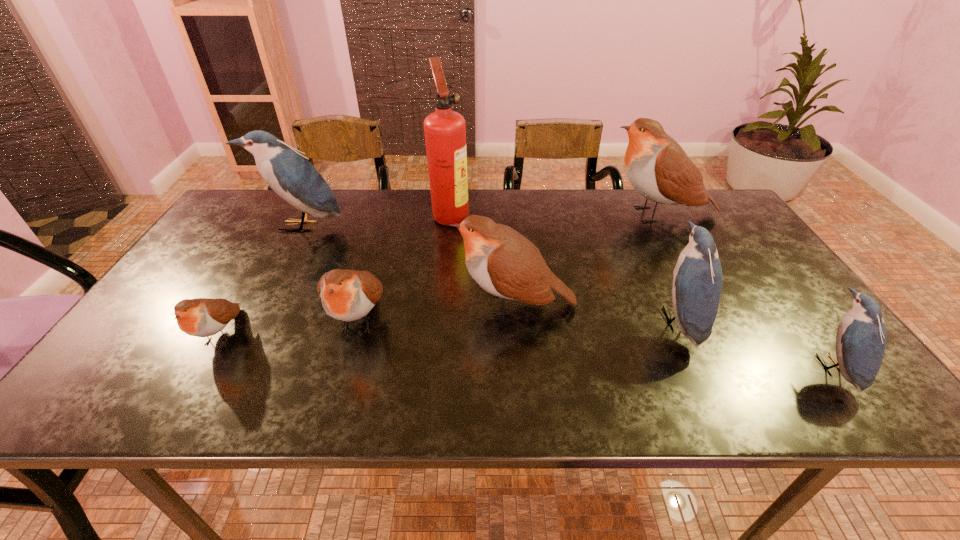
Find the location of a particular element. The width and height of the screenshot is (960, 540). free spot located at the face of the fourth bird from right to left is located at coordinates (397, 305).

Locate an element on the screen. Image resolution: width=960 pixels, height=540 pixels. free space located 0.160m at the face of the fourth bird from right to left is located at coordinates (389, 305).

The width and height of the screenshot is (960, 540). I want to click on blank space located at the tip of the second smallest blue bird's beak, so click(x=558, y=320).

The height and width of the screenshot is (540, 960). I want to click on vacant space situated 0.320m at the tip of the second smallest blue bird's beak, so click(524, 320).

Image resolution: width=960 pixels, height=540 pixels. In order to click on vacant point located 0.060m at the tip of the second smallest blue bird's beak in this screenshot , I will do `click(634, 320)`.

Find the location of `vacant space located 0.050m at the face of the fifth bird from right to left`. vacant space located 0.050m at the face of the fifth bird from right to left is located at coordinates (343, 379).

Where is `free space located 0.260m at the tip of the rightmost blue bird's beak`? free space located 0.260m at the tip of the rightmost blue bird's beak is located at coordinates (695, 367).

Where is `free space located at the tip of the rightmost blue bird's beak`? free space located at the tip of the rightmost blue bird's beak is located at coordinates (770, 367).

This screenshot has width=960, height=540. What are the coordinates of `free space located at the tip of the rightmost blue bird's beak` in the screenshot? It's located at (x=676, y=367).

I want to click on vacant space positioned 0.060m at the face of the smallest brown bird, so (x=189, y=390).